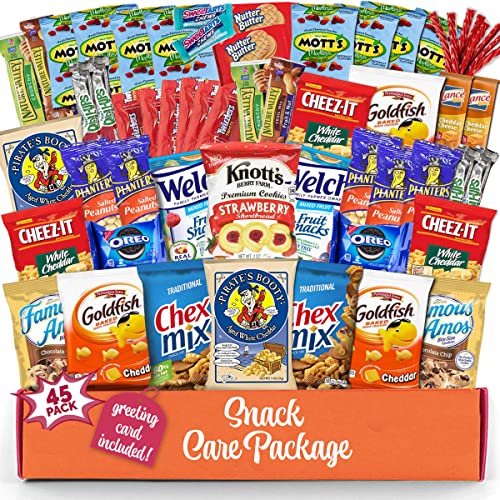
You are a GUI agent. You are given a task and a screenshot of the screen. Output one action in this format:
    pyautogui.click(x=<x>, y=<y>)
    Task: Click on the box corners
    
    Given the screenshot: What is the action you would take?
    pyautogui.click(x=20, y=475), pyautogui.click(x=20, y=391), pyautogui.click(x=480, y=477), pyautogui.click(x=484, y=389)